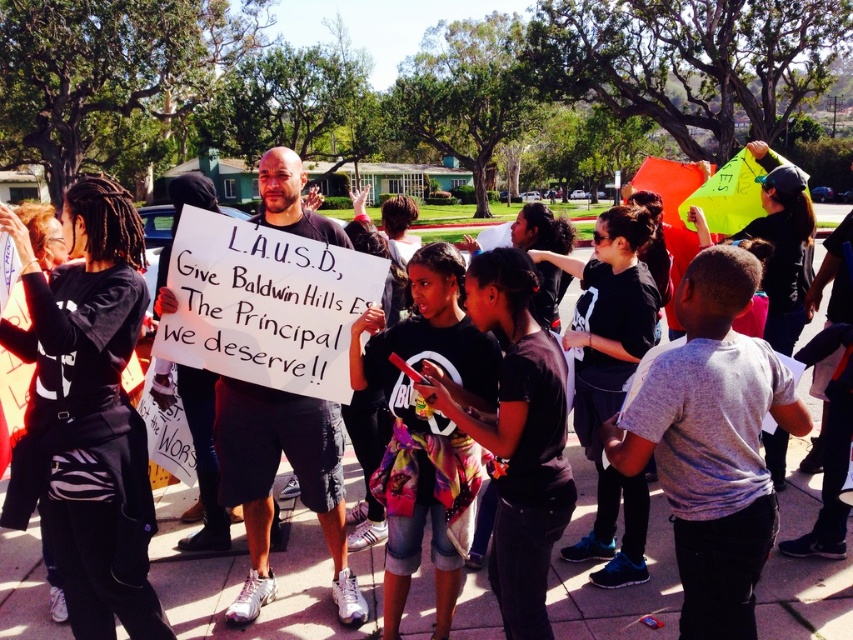
Question: Is multicolored denim shorts at center to the left of white paper sign at center from the viewer's perspective?

Choices:
 (A) yes
 (B) no

Answer: (B)

Question: Is multicolored denim shorts at center to the left of white paper sign at center from the viewer's perspective?

Choices:
 (A) yes
 (B) no

Answer: (B)

Question: Does multicolored denim shorts at center have a smaller size compared to white paper sign at center?

Choices:
 (A) no
 (B) yes

Answer: (B)

Question: Which point is closer to the camera?

Choices:
 (A) (416, 273)
 (B) (230, 420)

Answer: (A)